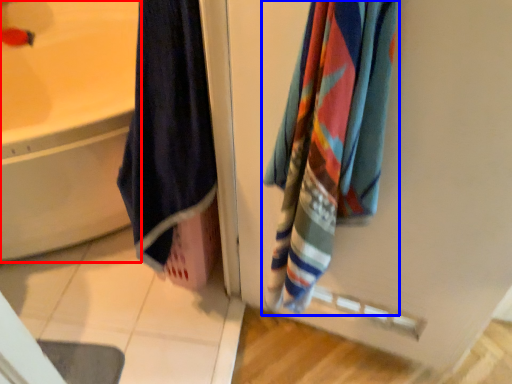
Question: Among these objects, which one is nearest to the camera, bathtub (highlighted by a red box) or towel (highlighted by a blue box)?

Choices:
 (A) bathtub
 (B) towel

Answer: (B)